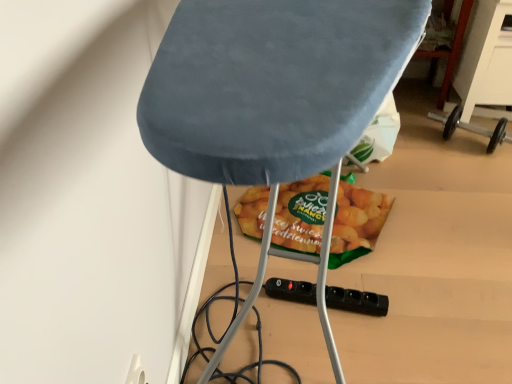
Identify the location of space that is in front of black plastic socket at lower center. (340, 348).